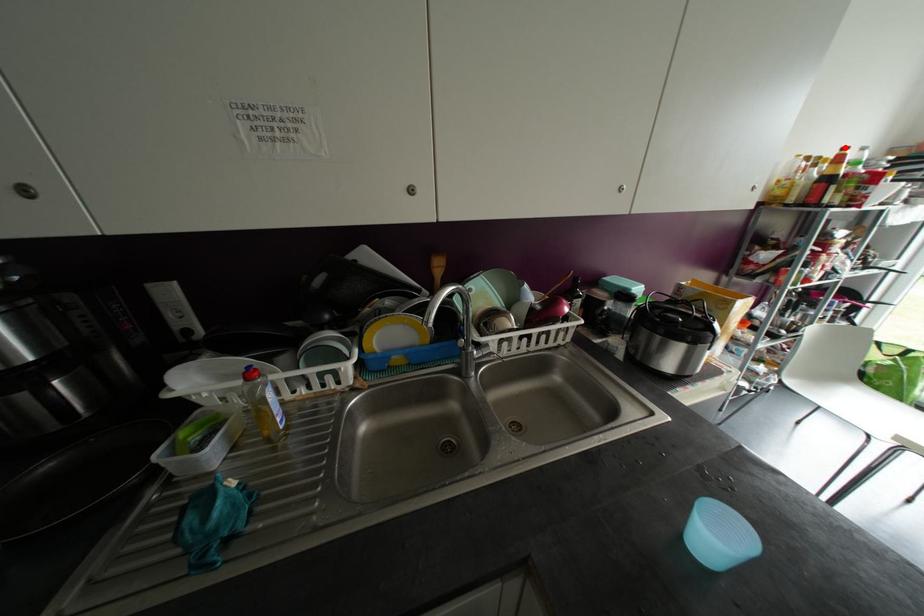
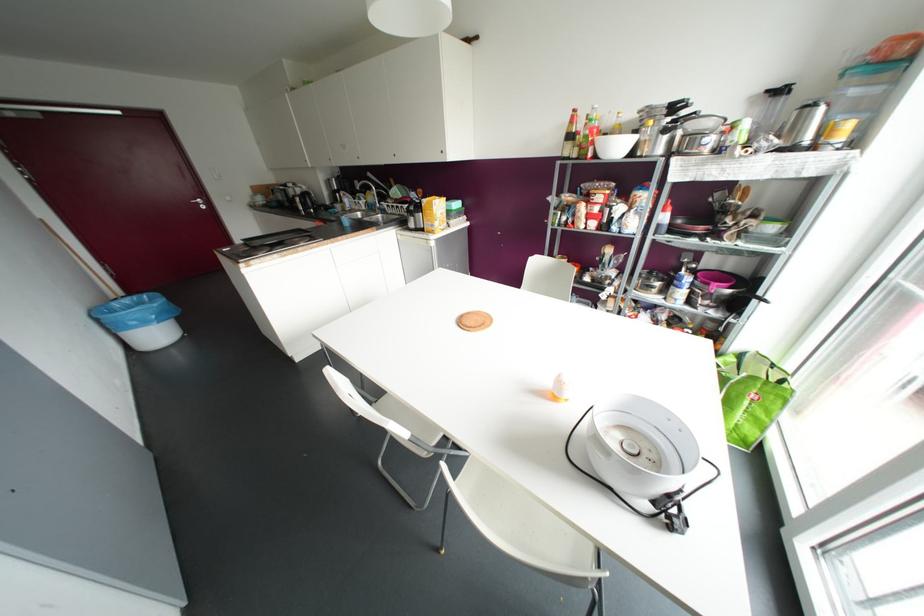
Question: A red point is marked in image1. In image2, is the corresponding 3D point closer to the camera or farther? Reply with the corresponding letter.

Choices:
 (A) The corresponding 3D point is closer.
 (B) The corresponding 3D point is farther.

Answer: (A)